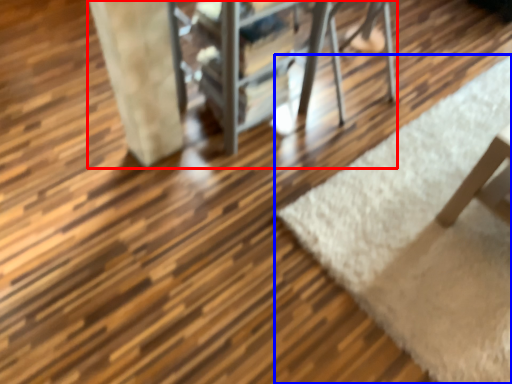
Question: Which of the following is the closest to the observer, furniture (highlighted by a red box) or mat (highlighted by a blue box)?

Choices:
 (A) furniture
 (B) mat

Answer: (A)